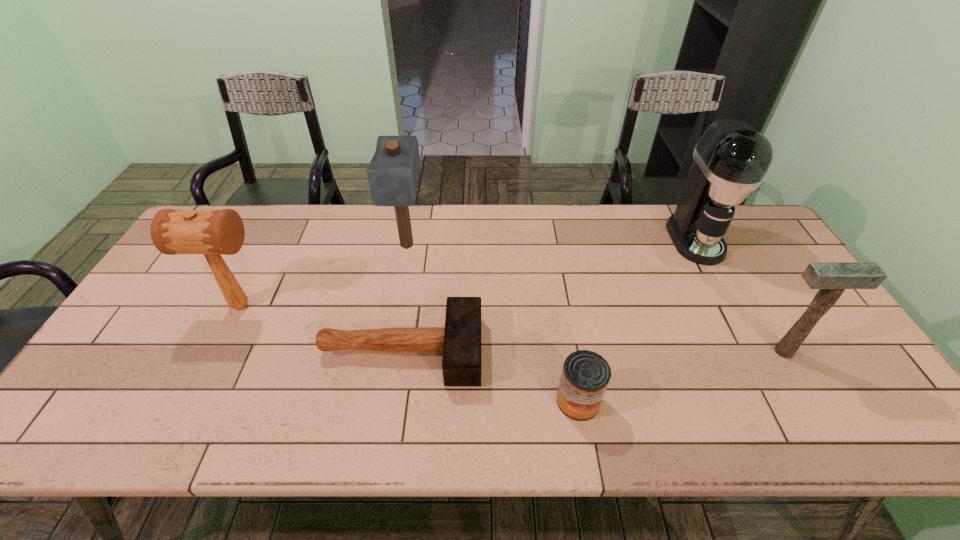
This screenshot has height=540, width=960. I want to click on vacant region located 0.070m on the left of the rightmost mallet, so click(728, 352).

Where is `free space located on the left of the can`? free space located on the left of the can is located at coordinates (392, 401).

Identify the location of vacant position located 0.210m on the hammer head face of the shortest object. Image resolution: width=960 pixels, height=540 pixels. (564, 350).

Where is `coffee maker present at the far edge`? coffee maker present at the far edge is located at coordinates (731, 159).

Image resolution: width=960 pixels, height=540 pixels. In order to click on mallet positioned at the far edge in this screenshot , I will do `click(393, 172)`.

I want to click on object positioned at the near edge, so click(585, 376).

At what (x,y) coordinates should I click in order to perform the action: click on coffee maker that is positioned at the right edge. Please return your answer as a coordinate pair (x, y). The image size is (960, 540). Looking at the image, I should click on (731, 159).

You are a GUI agent. You are given a task and a screenshot of the screen. Output one action in this format:
    pyautogui.click(x=<x>, y=<y>)
    Task: Click on the mallet at the right edge
    
    Given the screenshot: What is the action you would take?
    pyautogui.click(x=832, y=278)

Locate an element on the screen. This screenshot has height=540, width=960. object present at the far right corner is located at coordinates (731, 159).

Find the location of a particular element. The width and height of the screenshot is (960, 540). free space at the far edge is located at coordinates (518, 208).